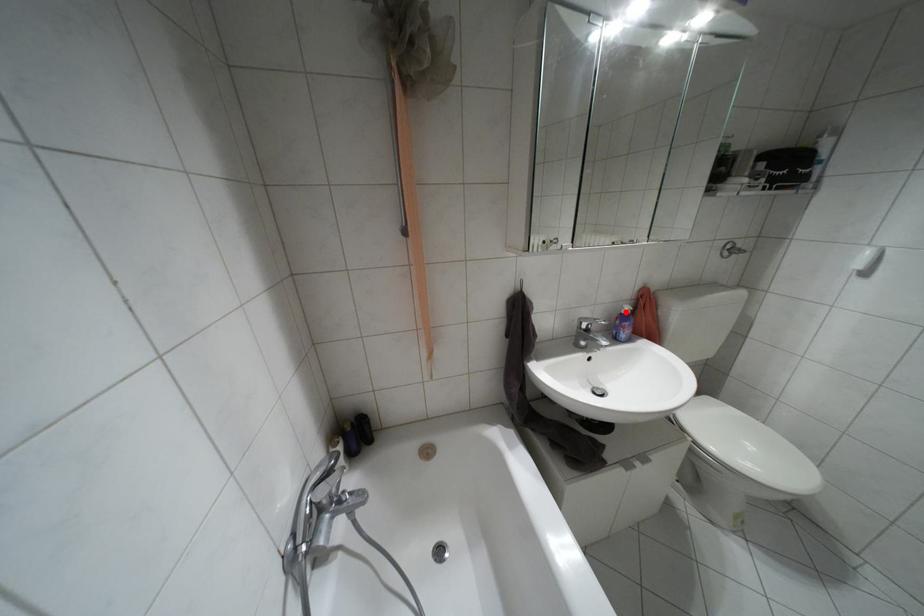
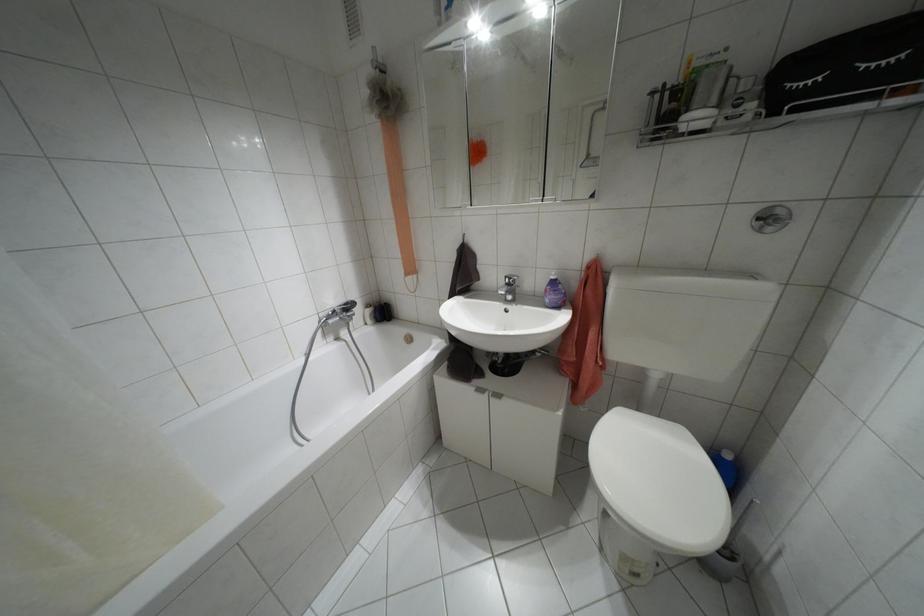
In the second image, find the point that corresponds to the highlighted location in the first image.

(552, 277)